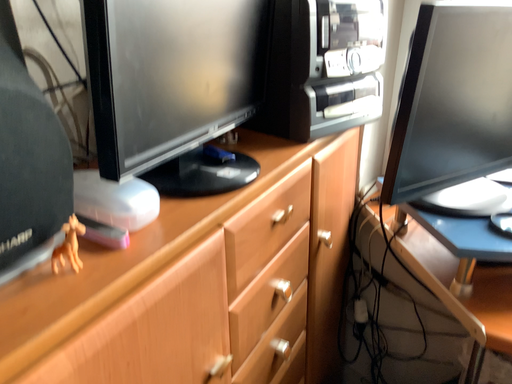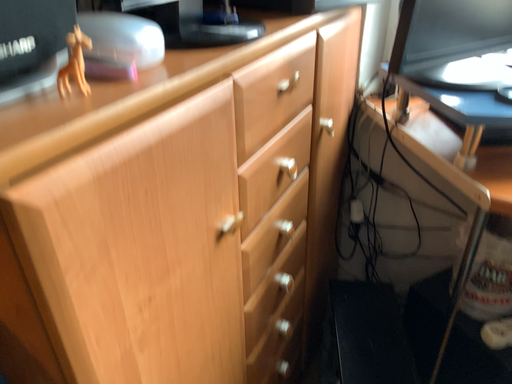
Question: How did the camera likely rotate when shooting the video?

Choices:
 (A) rotated downward
 (B) rotated upward

Answer: (A)